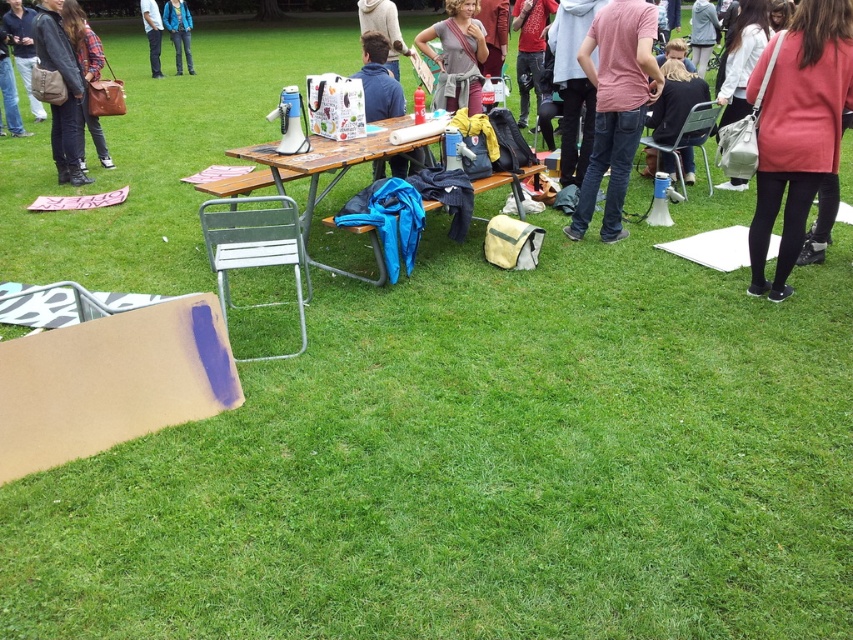
You are organizing an outdoor event and need to place a new sign on the wooden table. The sign requires a space that is not occupied by the blue fabric jacket at center. Where should you place the sign to ensure it doesn not overlap with the jacket?

The blue fabric jacket at center is located at point (378, 80). To avoid overlapping, place the sign in an area of the table that is not at those coordinates, such as the opposite side or another corner.

You are standing in the park and want to take a photo of the two points mentioned. Which point, point (619,202) or point (451,1), will appear larger in your camera view?

Point (619,202) is closer to the camera than point (451,1), so it will appear larger in the photo.

You are organizing an outdoor event and need to retrieve the brown leather bag at left for supplies. The blue fabric jacket at center is blocking your path. Can you move the jacket to access the bag?

The blue fabric jacket at center is below the brown leather bag at left, so moving the jacket would allow you to access the bag.